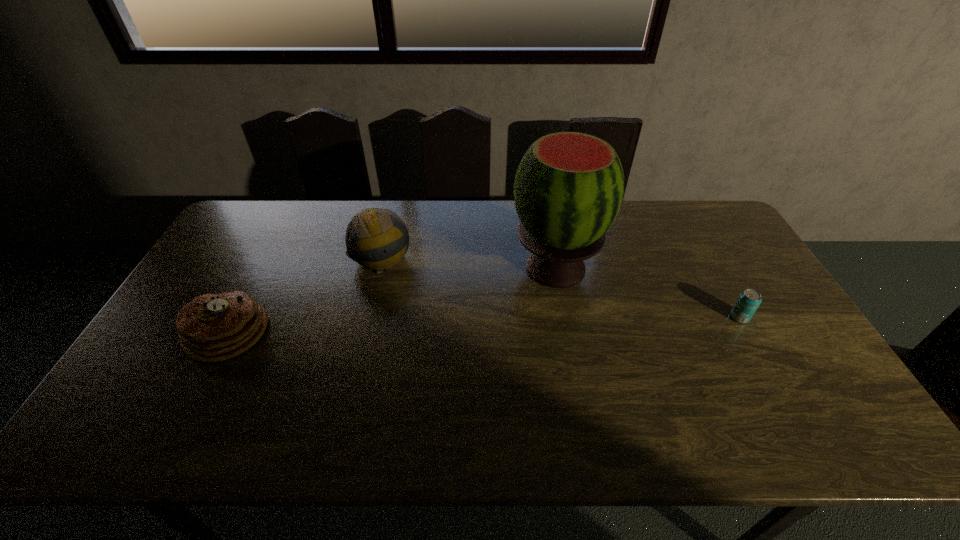
The height and width of the screenshot is (540, 960). In order to click on object identified as the third closest to the beer can in this screenshot , I will do `click(211, 328)`.

Locate an element on the screen. This screenshot has width=960, height=540. object that is the third nearest to the third object from right to left is located at coordinates (749, 300).

I want to click on free space that satisfies the following two spatial constraints: 1. on the back side of the third tallest object; 2. on the right side of the rightmost object, so pyautogui.click(x=235, y=317).

Where is `free spot that satisfies the following two spatial constraints: 1. on the back side of the pancake; 2. on the right side of the third object from right to left`? This screenshot has height=540, width=960. free spot that satisfies the following two spatial constraints: 1. on the back side of the pancake; 2. on the right side of the third object from right to left is located at coordinates (266, 259).

The width and height of the screenshot is (960, 540). I want to click on vacant region that satisfies the following two spatial constraints: 1. on the back side of the pancake; 2. on the left side of the third shortest object, so click(x=266, y=259).

Locate an element on the screen. blank area in the image that satisfies the following two spatial constraints: 1. on the front side of the shortest object; 2. on the right side of the second object from left to right is located at coordinates (368, 317).

You are a GUI agent. You are given a task and a screenshot of the screen. Output one action in this format:
    pyautogui.click(x=<x>, y=<y>)
    Task: Click on the vacant space that satisfies the following two spatial constraints: 1. on the front side of the third shortest object; 2. on the right side of the rightmost object
    This screenshot has width=960, height=540.
    Given the screenshot: What is the action you would take?
    pyautogui.click(x=368, y=317)